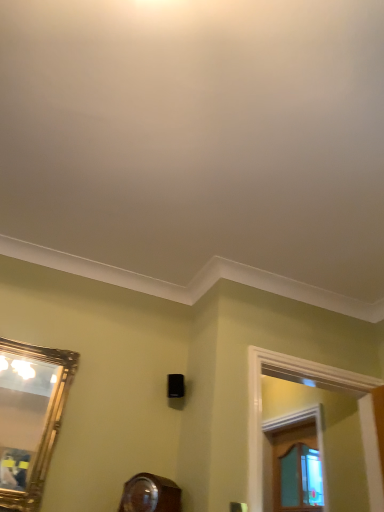
Question: Is the depth of wooden window frame at right, which ranks as the first window frame in back-to-front order, less than that of white wood window frame at upper right, the first window frame from the front?

Choices:
 (A) yes
 (B) no

Answer: (B)

Question: From a real-world perspective, is wooden window frame at right, the 2th window frame viewed from the front, over white wood window frame at upper right, placed as the second window frame when sorted from back to front?

Choices:
 (A) no
 (B) yes

Answer: (B)

Question: Can you confirm if wooden window frame at right, which ranks as the first window frame in back-to-front order, is positioned to the left of white wood window frame at upper right, placed as the second window frame when sorted from back to front?

Choices:
 (A) no
 (B) yes

Answer: (A)

Question: Is wooden window frame at right, which ranks as the first window frame in back-to-front order, further to the viewer compared to white wood window frame at upper right, the first window frame from the front?

Choices:
 (A) no
 (B) yes

Answer: (B)

Question: Can you confirm if wooden window frame at right, the 2th window frame viewed from the front, is wider than white wood window frame at upper right, placed as the second window frame when sorted from back to front?

Choices:
 (A) yes
 (B) no

Answer: (B)

Question: From the image's perspective, is wooden window frame at right, which ranks as the first window frame in back-to-front order, located above white wood window frame at upper right, the first window frame from the front?

Choices:
 (A) no
 (B) yes

Answer: (A)

Question: From the image's perspective, is white wood window frame at upper right, placed as the second window frame when sorted from back to front, below wooden window frame at right, which ranks as the first window frame in back-to-front order?

Choices:
 (A) no
 (B) yes

Answer: (A)

Question: From a real-world perspective, is white wood window frame at upper right, placed as the second window frame when sorted from back to front, under wooden window frame at right, which ranks as the first window frame in back-to-front order?

Choices:
 (A) yes
 (B) no

Answer: (A)

Question: From a real-world perspective, is white wood window frame at upper right, placed as the second window frame when sorted from back to front, physically above wooden window frame at right, the 2th window frame viewed from the front?

Choices:
 (A) yes
 (B) no

Answer: (B)

Question: Is white wood window frame at upper right, placed as the second window frame when sorted from back to front, wider than wooden window frame at right, which ranks as the first window frame in back-to-front order?

Choices:
 (A) no
 (B) yes

Answer: (B)

Question: Are white wood window frame at upper right, the first window frame from the front, and wooden window frame at right, which ranks as the first window frame in back-to-front order, far apart?

Choices:
 (A) no
 (B) yes

Answer: (A)

Question: Is white wood window frame at upper right, placed as the second window frame when sorted from back to front, facing away from wooden window frame at right, the 2th window frame viewed from the front?

Choices:
 (A) yes
 (B) no

Answer: (A)

Question: From the image's perspective, is gold-framed mirror at left beneath white wood window frame at upper right, the first window frame from the front?

Choices:
 (A) yes
 (B) no

Answer: (B)